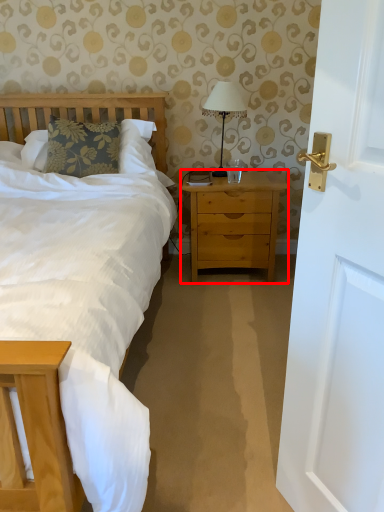
Question: Where is nightstand (annotated by the red box) located in relation to bedside lamp in the image?

Choices:
 (A) left
 (B) right

Answer: (B)